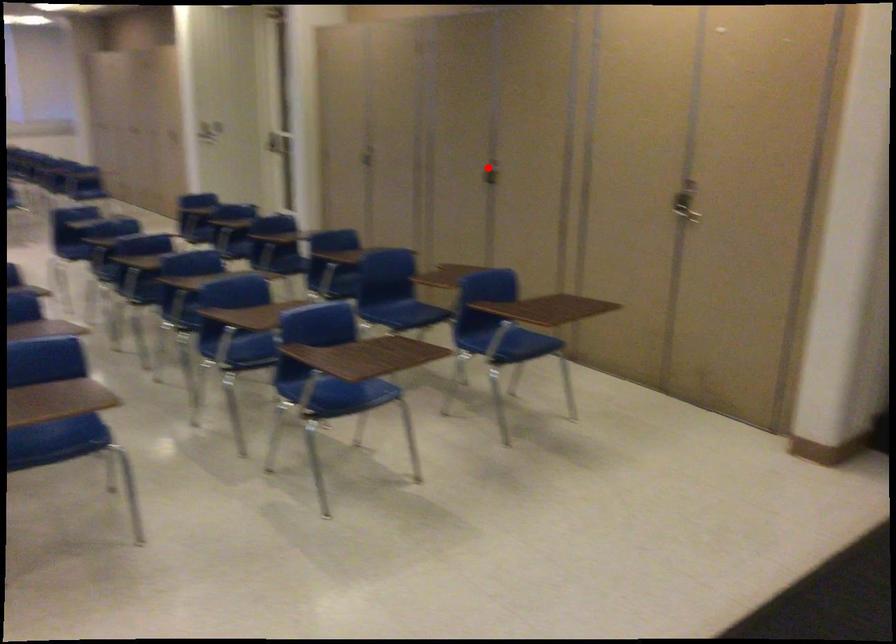
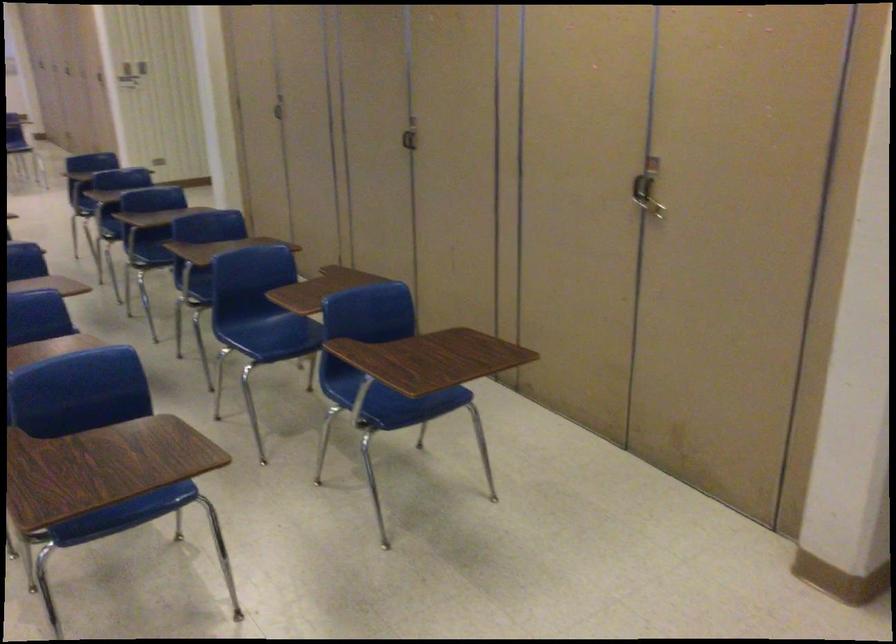
Question: I am providing you with two images of the same scene from different viewpoints. A red point is shown in image1. For the corresponding object point in image2, is it positioned nearer or farther from the camera?

Choices:
 (A) Nearer
 (B) Farther

Answer: (A)